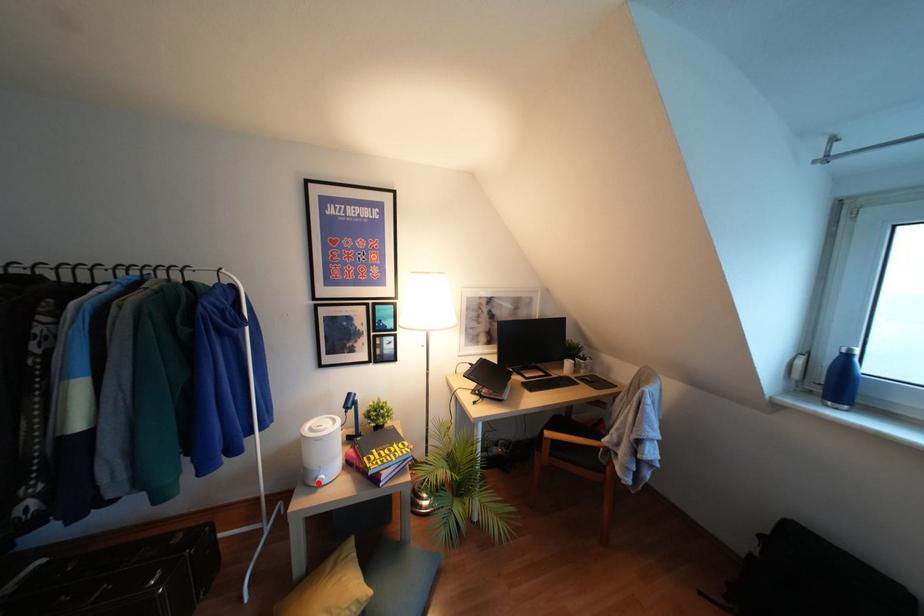
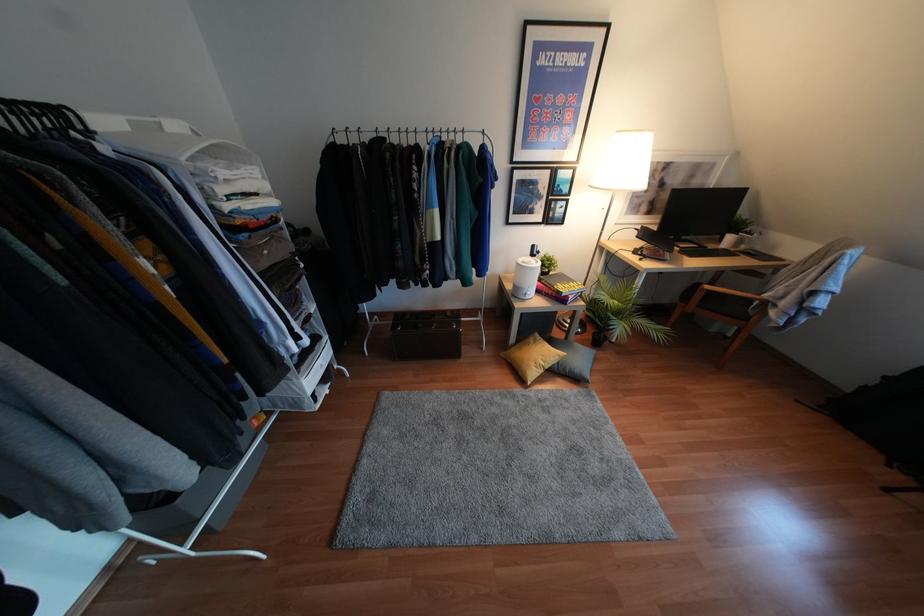
Question: I am providing you with two images of the same scene from different viewpoints. A red point is shown in image1. For the corresponding object point in image2, is it positioned nearer or farther from the camera?

Choices:
 (A) Nearer
 (B) Farther

Answer: (A)